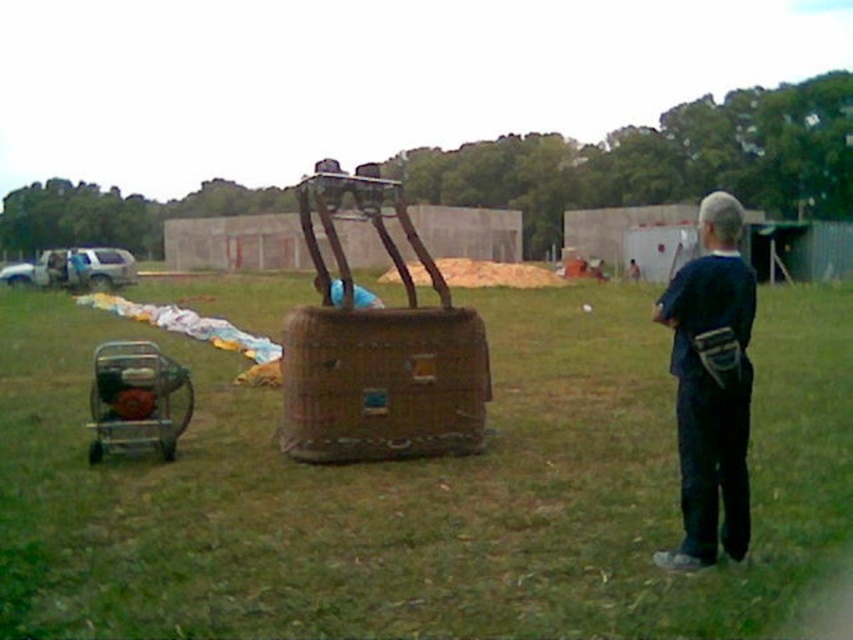
You are a photographer setting up equipment for a hot air balloon event. You have a brushed metal cart at lower left and a blue fabric at center. Which object is taller?

The blue fabric at center is taller than the brushed metal cart at lower left.

You are standing in the hot air balloon area and notice the dark blue shirt at right and the brushed metal cart at lower left. Which object is closer to you?

The dark blue shirt at right is closer to you because it is in front of the brushed metal cart at lower left.